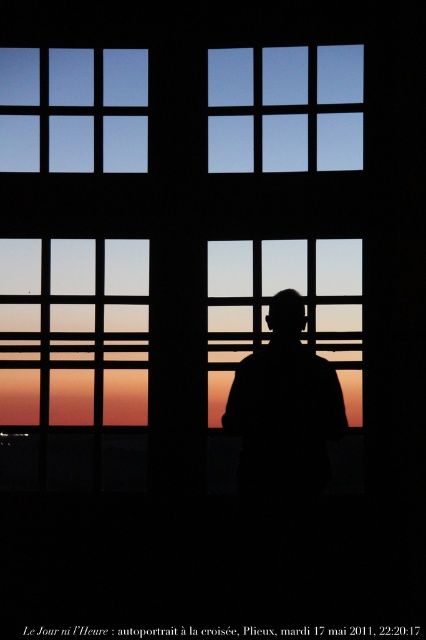
You are standing in a room with a large window. There is a point at coordinates (284, 108). What object is located at that point?

The point at (284, 108) is located at the transparent glass window at upper center.

From the picture: You are standing in a room with a large window. You see a point at coordinates point (238, 56). Is this point closer to the camera than 30 feet?

The point (238, 56) is 28.82 feet from the camera, so yes, it is closer than 30 feet.